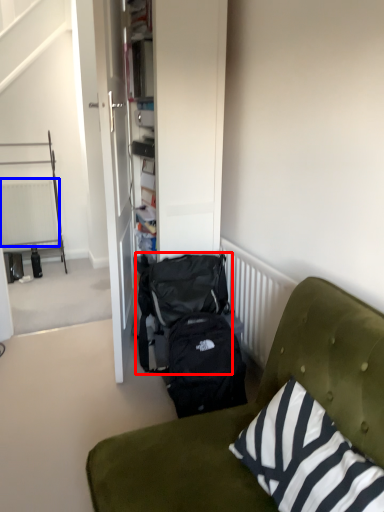
Question: Among these objects, which one is farthest to the camera, backpack (highlighted by a red box) or radiator (highlighted by a blue box)?

Choices:
 (A) backpack
 (B) radiator

Answer: (B)